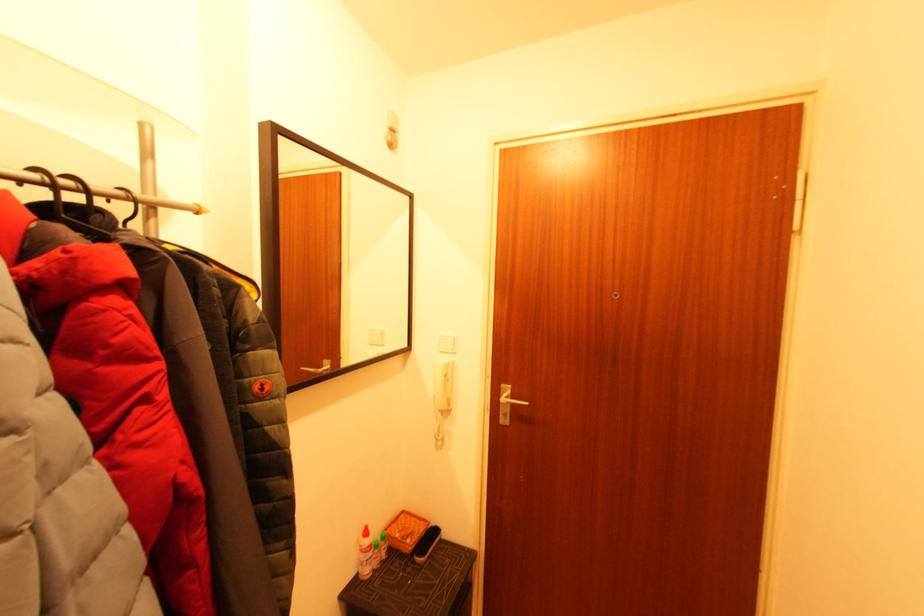
Where would you lift the black shoe brush? Please return your answer as a coordinate pair (x, y).

(426, 543)